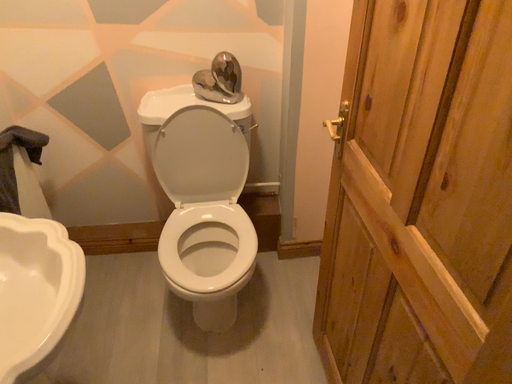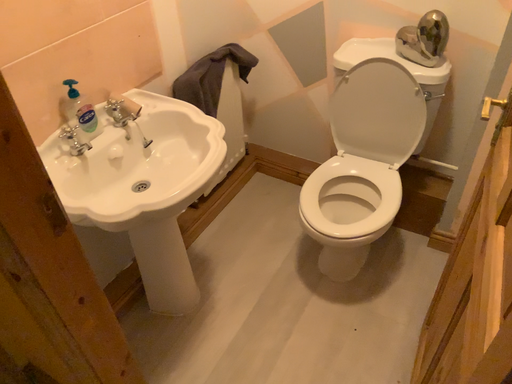
Question: Which way did the camera rotate in the video?

Choices:
 (A) rotated right
 (B) rotated left

Answer: (B)